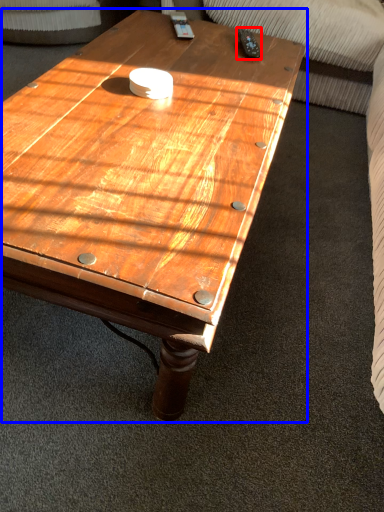
Question: Which object is further to the camera taking this photo, remote (highlighted by a red box) or coffee table (highlighted by a blue box)?

Choices:
 (A) remote
 (B) coffee table

Answer: (A)